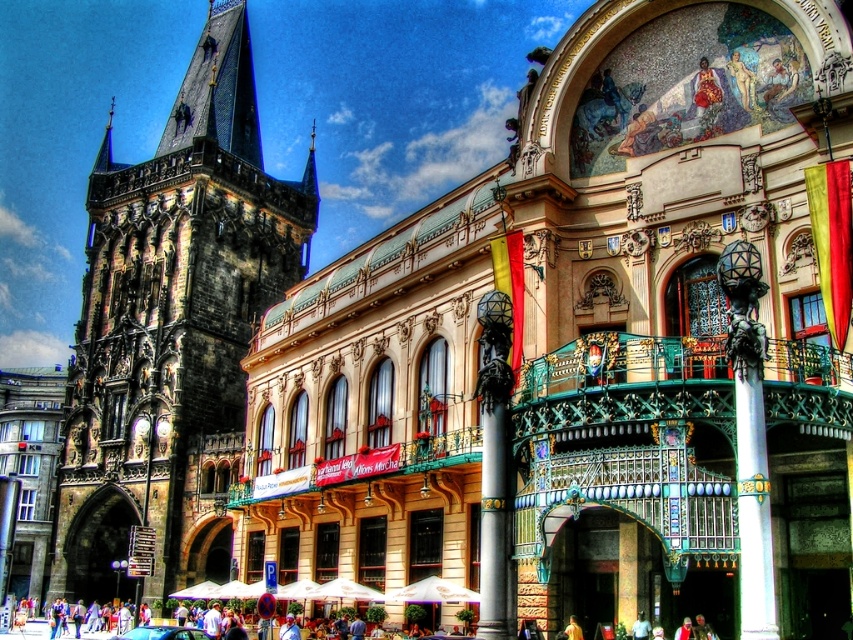
You are standing in the city square and want to take a photo of both the dark stone tower at left and the metallic blue car at center. Which object should you position closer to the camera to include both in the frame?

You should position the dark stone tower at left closer to the camera since it is already further away than the metallic blue car at center, allowing both to be in the frame.